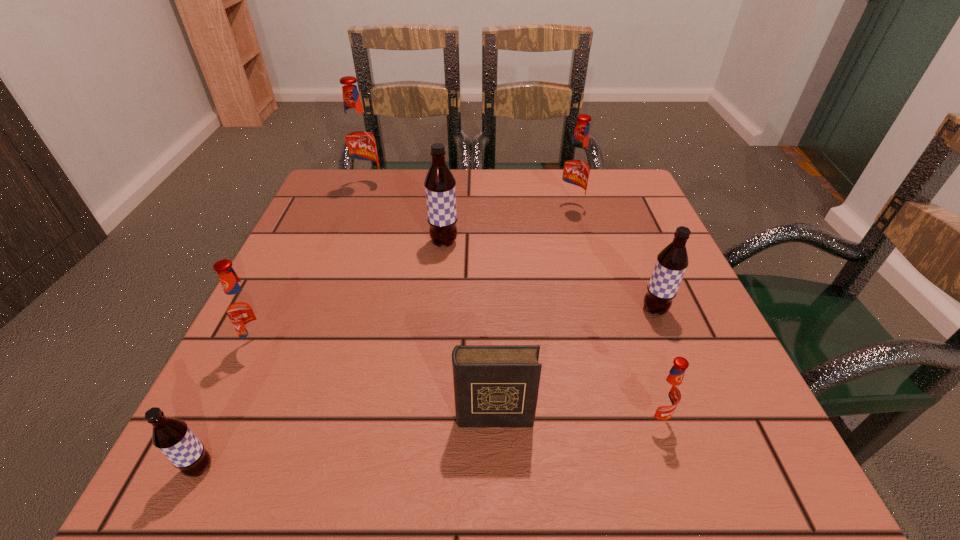
The image size is (960, 540). Identify the location of free space located 0.170m on the front of the third farthest red root beer. (209, 455).

Find the location of a particular element. vacant space located 0.060m on the front cover of the dark diary is located at coordinates (495, 469).

You are a GUI agent. You are given a task and a screenshot of the screen. Output one action in this format:
    pyautogui.click(x=<x>, y=<y>)
    Task: Click on the vacant region located on the right of the smallest red root beer
    This screenshot has width=960, height=540.
    Given the screenshot: What is the action you would take?
    pyautogui.click(x=742, y=419)

This screenshot has width=960, height=540. What are the coordinates of `vacant space situated on the right of the nearest object` in the screenshot? It's located at (341, 468).

Locate an element on the screen. This screenshot has height=540, width=960. diary present at the near edge is located at coordinates (x=494, y=385).

The width and height of the screenshot is (960, 540). I want to click on object that is at the far left corner, so click(359, 140).

Where is `object that is at the near left corner`? This screenshot has height=540, width=960. object that is at the near left corner is located at coordinates (172, 436).

Identify the location of object situated at the far right corner. This screenshot has width=960, height=540. pos(576,167).

Locate an element on the screen. object located in the near right corner section of the desktop is located at coordinates (666, 394).

Locate an element on the screen. Image resolution: width=960 pixels, height=540 pixels. vacant space at the far edge of the desktop is located at coordinates (479, 192).